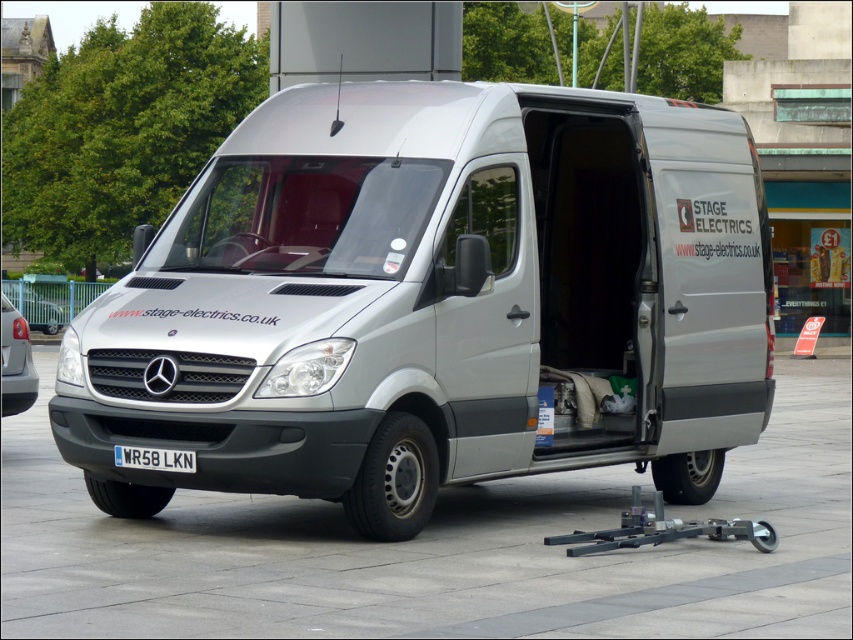
Between silver metallic van at left and white plastic license plate at center, which one has less height?

With less height is white plastic license plate at center.

Identify the location of silver metallic van at left. (16, 362).

Who is higher up, satin silver van at center or silver metallic van at left?

Positioned higher is satin silver van at center.

Does point (448, 284) come farther from viewer compared to point (19, 387)?

No, (448, 284) is in front of (19, 387).

Locate an element on the screen. This screenshot has height=640, width=853. satin silver van at center is located at coordinates (434, 301).

Can you confirm if satin silver van at center is thinner than white plastic license plate at center?

No, satin silver van at center is not thinner than white plastic license plate at center.

Which of these two, satin silver van at center or white plastic license plate at center, stands shorter?

white plastic license plate at center

What do you see at coordinates (434, 301) in the screenshot?
I see `satin silver van at center` at bounding box center [434, 301].

Where is `satin silver van at center`? The width and height of the screenshot is (853, 640). satin silver van at center is located at coordinates (434, 301).